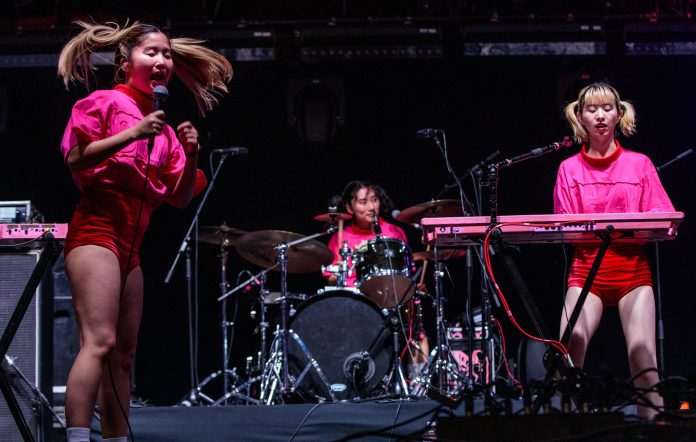
In order to click on keyboard in this screenshot , I will do `click(633, 223)`.